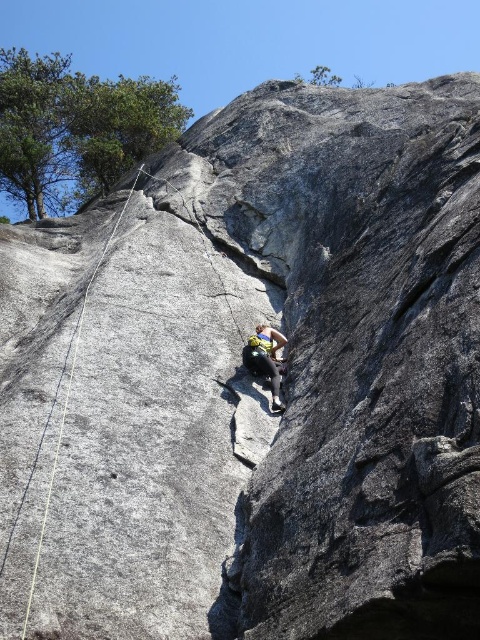
Question: Can you confirm if yellow nylon rope at left is wider than yellow climbing harness at center?

Choices:
 (A) yes
 (B) no

Answer: (B)

Question: Is yellow nylon rope at left further to the viewer compared to yellow climbing harness at center?

Choices:
 (A) yes
 (B) no

Answer: (B)

Question: Can you confirm if yellow nylon rope at left is positioned to the right of yellow climbing harness at center?

Choices:
 (A) yes
 (B) no

Answer: (B)

Question: Which point is closer to the camera taking this photo?

Choices:
 (A) [260, 323]
 (B) [31, 588]

Answer: (B)